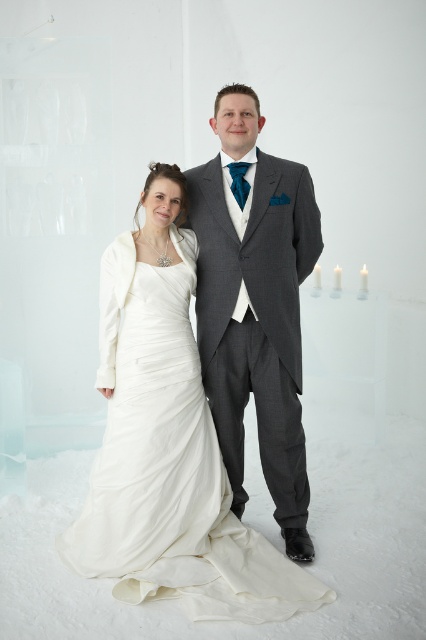
Question: Does satin white dress at center appear over gray wool suit at center?

Choices:
 (A) yes
 (B) no

Answer: (B)

Question: Which of the following is the closest to the observer?

Choices:
 (A) satin white dress at center
 (B) ivory satin dress at center
 (C) gray wool suit at center

Answer: (B)

Question: Which object is farther from the camera taking this photo?

Choices:
 (A) satin white dress at center
 (B) gray wool suit at center

Answer: (B)

Question: Can you confirm if ivory satin dress at center is positioned below gray wool suit at center?

Choices:
 (A) yes
 (B) no

Answer: (A)

Question: Which is farther from the satin white dress at center?

Choices:
 (A) gray wool suit at center
 (B) ivory satin dress at center

Answer: (A)

Question: In this image, where is satin white dress at center located relative to gray wool suit at center?

Choices:
 (A) left
 (B) right

Answer: (A)